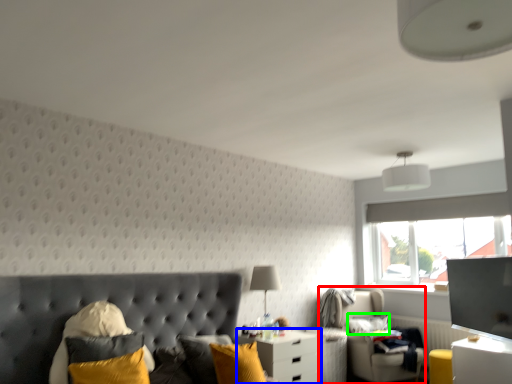
Question: Estimate the real-world distances between objects in this image. Which object is farther from swivel chair (highlighted by a red box), nightstand (highlighted by a blue box) or pillow (highlighted by a green box)?

Choices:
 (A) nightstand
 (B) pillow

Answer: (A)